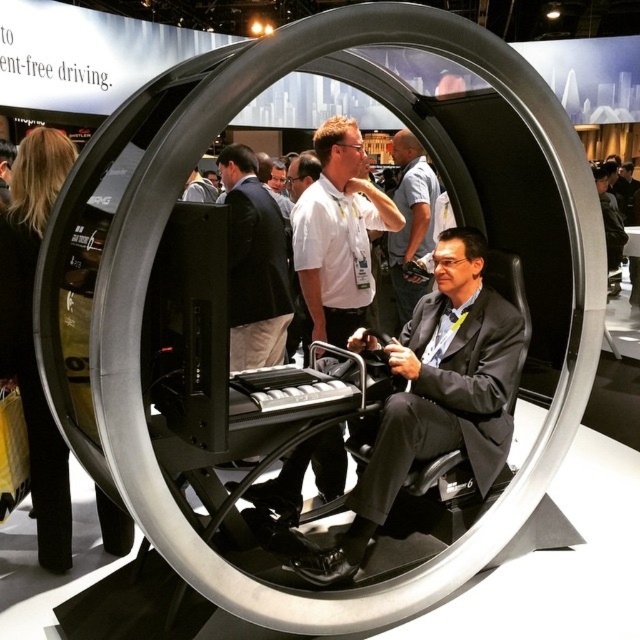
Question: Is white glossy shirt at center below white shirt at center?

Choices:
 (A) no
 (B) yes

Answer: (A)

Question: Which point appears farthest from the camera in this image?

Choices:
 (A) (243, 164)
 (B) (214, 193)

Answer: (B)

Question: Among these objects, which one is nearest to the camera?

Choices:
 (A) white shirt at center
 (B) matte black suit at center

Answer: (A)

Question: Does white glossy shirt at center appear on the right side of matte black suit at center?

Choices:
 (A) yes
 (B) no

Answer: (A)

Question: Which point is farther to the camera?

Choices:
 (A) (404, 157)
 (B) (504, 426)
 (C) (308, 458)

Answer: (A)

Question: Is the position of dark gray suit at center less distant than that of white glossy shirt at center?

Choices:
 (A) no
 (B) yes

Answer: (B)